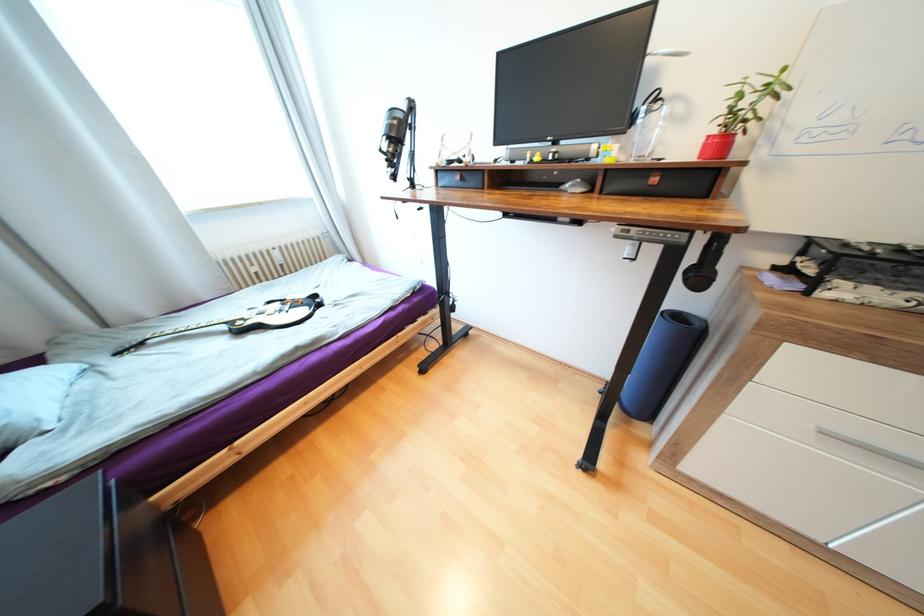
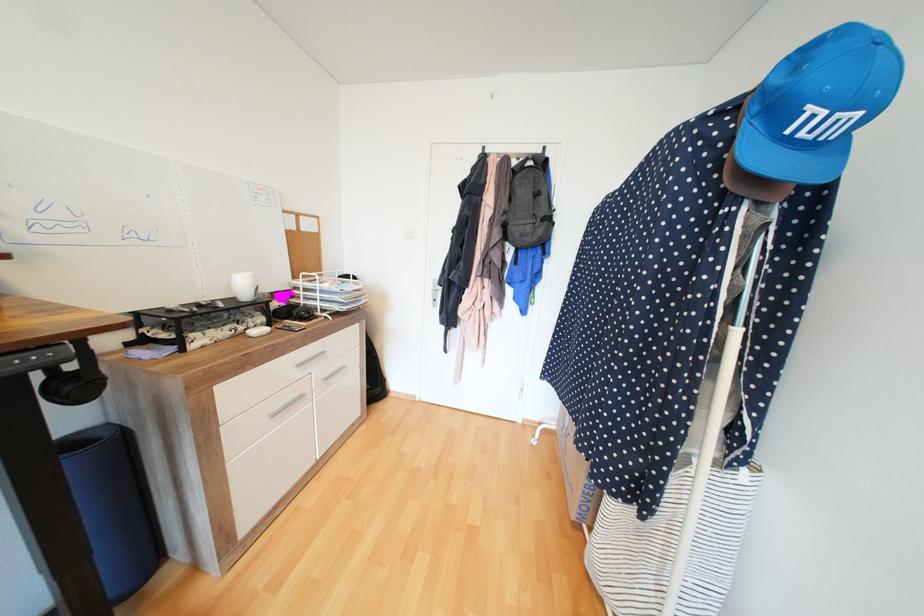
Find the pixel in the second image that matches the point at 707,278 in the first image.

(88, 387)